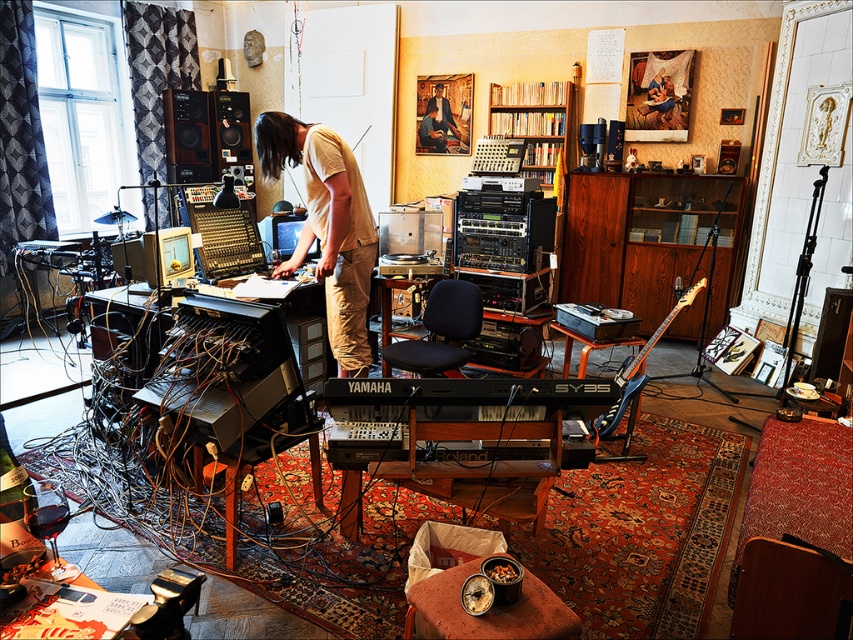
Looking at this image, you are a sound engineer needing to adjust the volume of the wooden speaker at upper left while standing at the smooth beige shirt at center. Is the distance between them sufficient for you to comfortably reach the speaker without moving your position?

The distance between the wooden speaker at upper left and the smooth beige shirt at center is 2.44 meters, which is too far to comfortably reach the speaker without moving. You would need to move closer to adjust the volume.

You are setting up a microphone stand in this music studio. The stand needs to be placed between the wooden speaker at upper left and the smooth beige shirt at center. Considering their heights, which object should the microphone stand avoid hitting when raising it to its maximum height?

The wooden speaker at upper left is much taller than the smooth beige shirt at center, so the microphone stand should avoid hitting the wooden speaker at upper left when raising it to its maximum height.